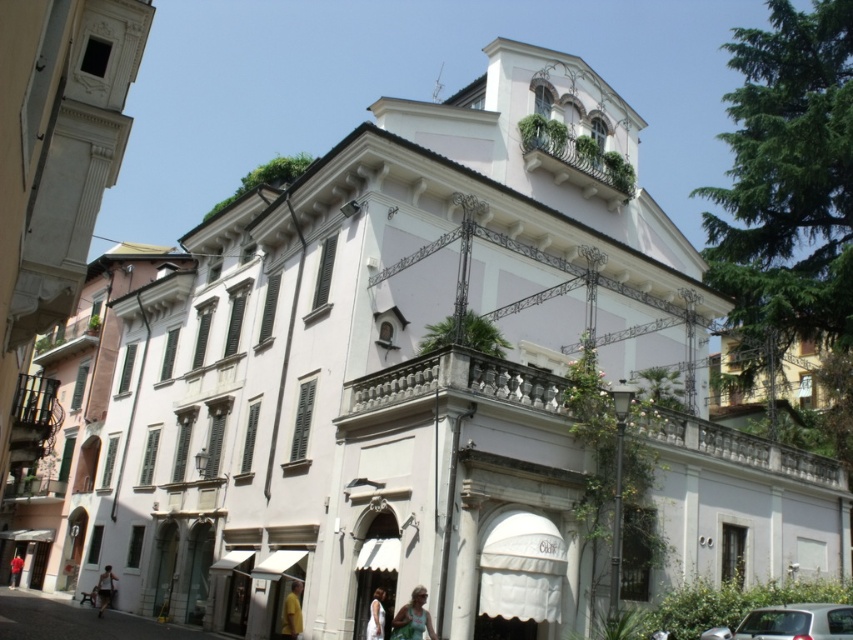
Question: Estimate the real-world distances between objects in this image. Which object is farther from the light brown fabric dress at lower center?

Choices:
 (A) red fabric person at center
 (B) light brown hair at lower center
 (C) silver metallic car at lower right
 (D) light brown leather jacket at lower left

Answer: (A)

Question: Is silver metallic car at lower right to the left of light brown fabric dress at lower center from the viewer's perspective?

Choices:
 (A) yes
 (B) no

Answer: (B)

Question: Which object is the farthest from the silver metallic car at lower right?

Choices:
 (A) light brown fabric dress at lower center
 (B) light brown leather jacket at lower left
 (C) red fabric person at center

Answer: (C)

Question: Can you confirm if light brown fabric dress at lower center is thinner than light brown leather jacket at lower left?

Choices:
 (A) no
 (B) yes

Answer: (B)

Question: Estimate the real-world distances between objects in this image. Which object is closer to the light brown hair at lower center?

Choices:
 (A) red fabric person at center
 (B) silver metallic car at lower right
 (C) light brown leather jacket at lower left

Answer: (B)

Question: Can you confirm if light brown leather jacket at lower left is bigger than red fabric person at center?

Choices:
 (A) no
 (B) yes

Answer: (B)